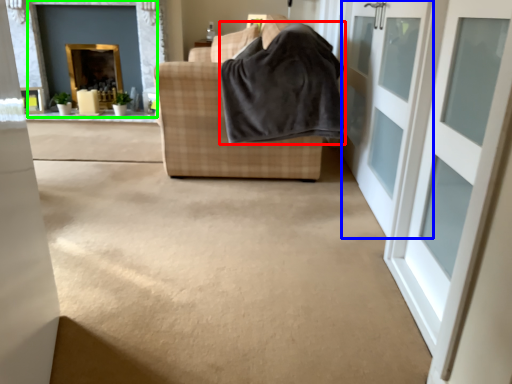
Question: Which object is positioned closest to blanket (highlighted by a red box)? Select from door (highlighted by a blue box) and fireplace (highlighted by a green box).

Choices:
 (A) door
 (B) fireplace

Answer: (A)